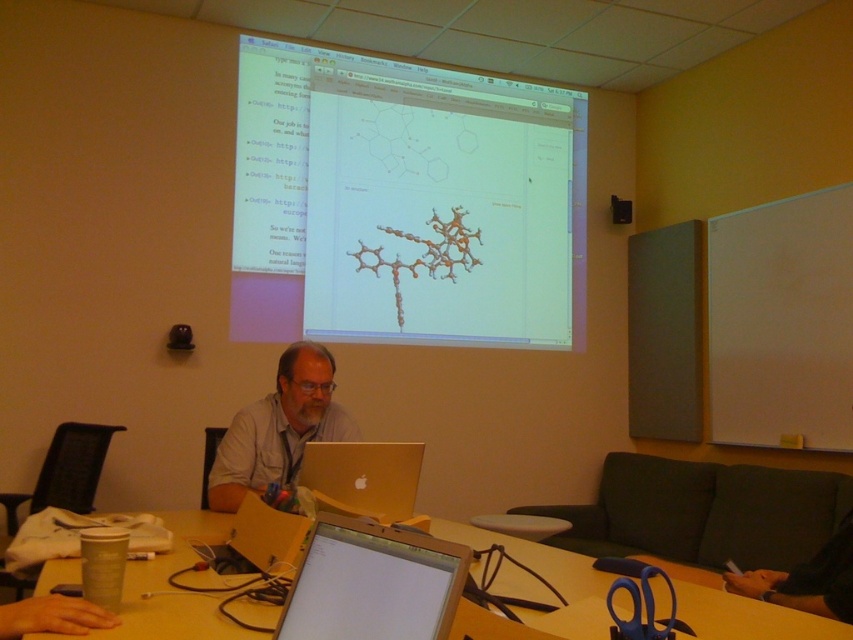
Question: Which object is the farthest from the gold metallic laptop at center?

Choices:
 (A) wooden table at lower center
 (B) gray fabric shirt at center

Answer: (B)

Question: Is wooden table at lower center positioned behind silver metallic laptop at center?

Choices:
 (A) no
 (B) yes

Answer: (A)

Question: Can you confirm if wooden table at lower center is thinner than gold metallic laptop at center?

Choices:
 (A) no
 (B) yes

Answer: (A)

Question: Which is nearer to the gold metallic laptop at center?

Choices:
 (A) matte silver tablet at center
 (B) wooden table at lower center
 (C) gray fabric shirt at center

Answer: (B)

Question: Does gold metallic laptop at center have a lesser width compared to silver metallic laptop at center?

Choices:
 (A) yes
 (B) no

Answer: (A)

Question: Based on their relative distances, which object is nearer to the translucent plastic screen at upper center?

Choices:
 (A) gray fabric shirt at center
 (B) silver metallic laptop at center
 (C) gold metallic laptop at center
 (D) wooden table at lower center

Answer: (A)